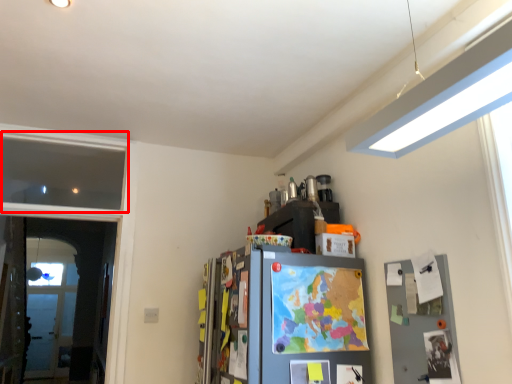
Question: Observing the image, what is the correct spatial positioning of window (annotated by the red box) in reference to screen door?

Choices:
 (A) left
 (B) right

Answer: (A)